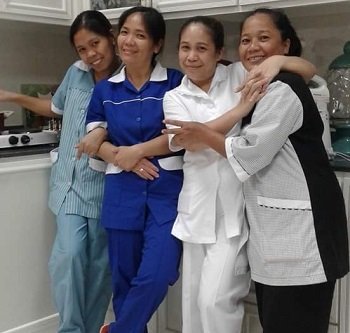
At what (x,y) coordinates should I click in order to perform the action: click on cabinets. Please return your answer as a coordinate pair (x, y). This screenshot has width=350, height=333. Looking at the image, I should click on (163, 4).